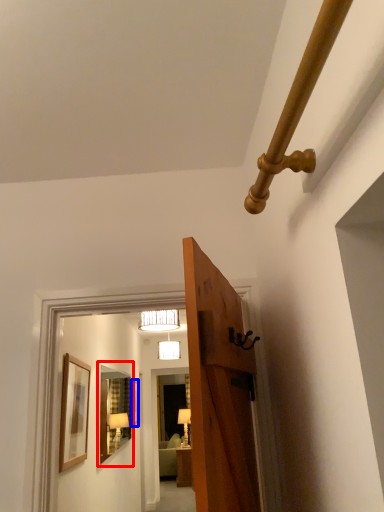
Question: Which of the following is the farthest to the observer, mirror (highlighted by a red box) or picture frame (highlighted by a blue box)?

Choices:
 (A) mirror
 (B) picture frame

Answer: (B)